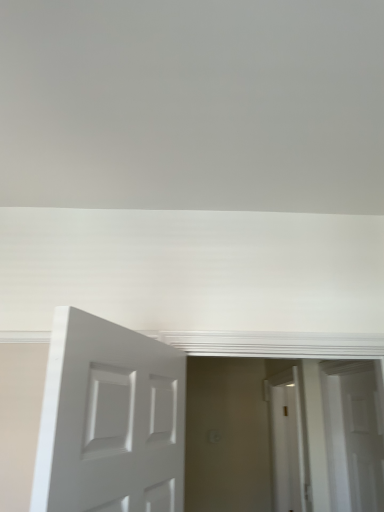
Locate an element on the screen. The image size is (384, 512). white matte door at center is located at coordinates (353, 435).

In the scene shown: In order to face white matte door at center, should I rotate leftwards or rightwards?

Turn right by 21.046 degrees to look at white matte door at center.

This screenshot has width=384, height=512. What do you see at coordinates (353, 435) in the screenshot?
I see `white matte door at center` at bounding box center [353, 435].

This screenshot has width=384, height=512. I want to click on white matte door at center, so click(x=353, y=435).